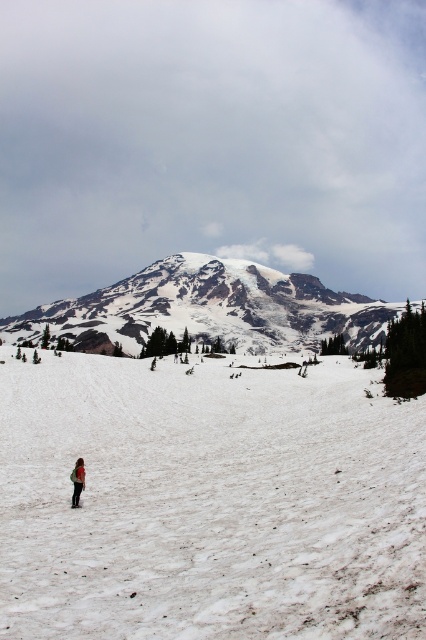
Which is behind, point (98, 388) or point (71, 499)?

Positioned behind is point (98, 388).

Who is taller, white snow at lower center or red fabric jacket at lower left?

white snow at lower center is taller.

Who is more distant from viewer, (299, 620) or (75, 465)?

The point (75, 465) is behind.

This screenshot has width=426, height=640. What are the coordinates of `white snow at lower center` in the screenshot? It's located at (209, 502).

Measure the distance between point [66,333] and camera.

Point [66,333] is 661.87 feet away from camera.

Where is `white snow-covered mountain at center`? Image resolution: width=426 pixels, height=640 pixels. white snow-covered mountain at center is located at coordinates tap(213, 307).

Can you confirm if white snow at lower center is positioned to the right of white snow-covered mountain at center?

Correct, you'll find white snow at lower center to the right of white snow-covered mountain at center.

Between point (360, 605) and point (141, 340), which one is positioned behind?

The point (141, 340) is more distant.

Locate an element on the screen. This screenshot has width=426, height=640. white snow at lower center is located at coordinates (209, 502).